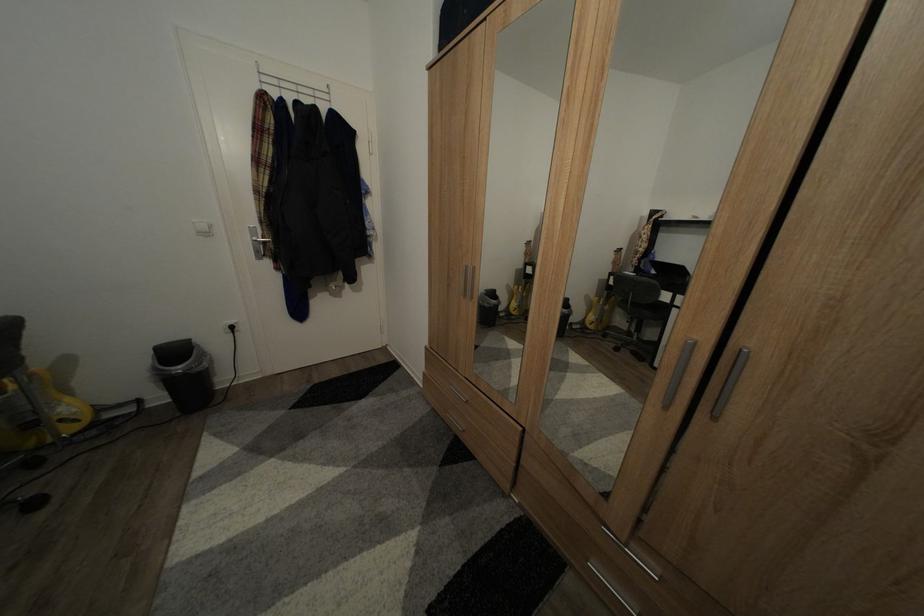
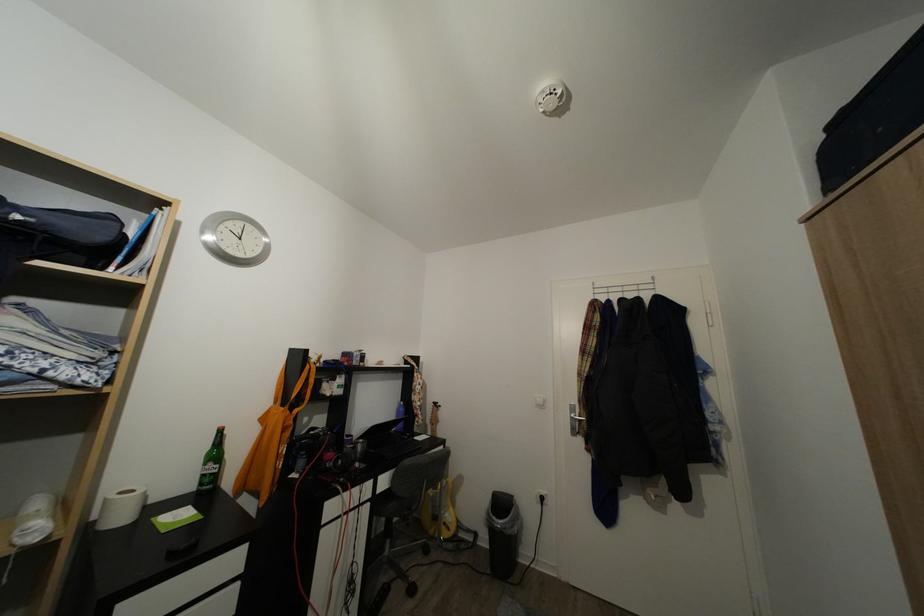
The point at (184, 359) is marked in the first image. Where is the corresponding point in the second image?

(509, 511)